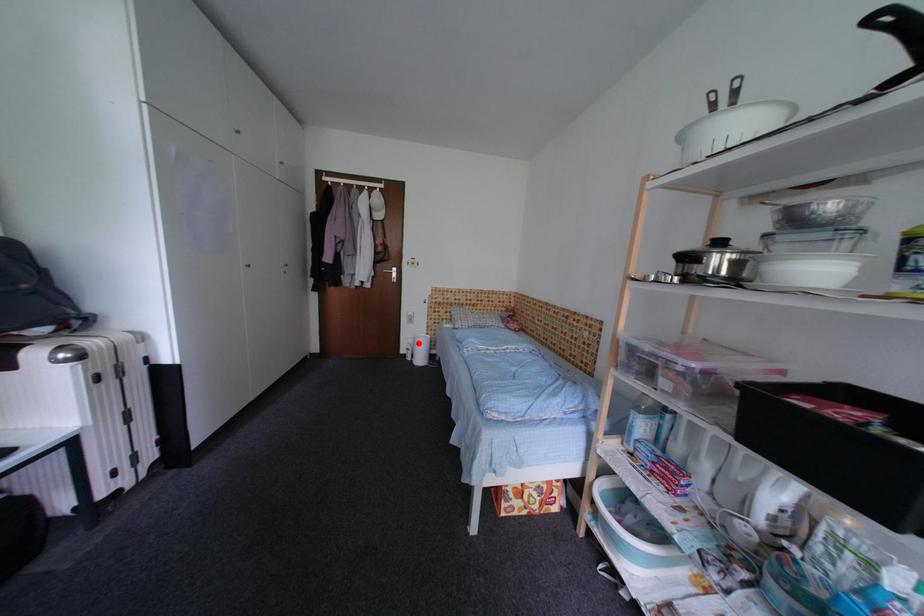
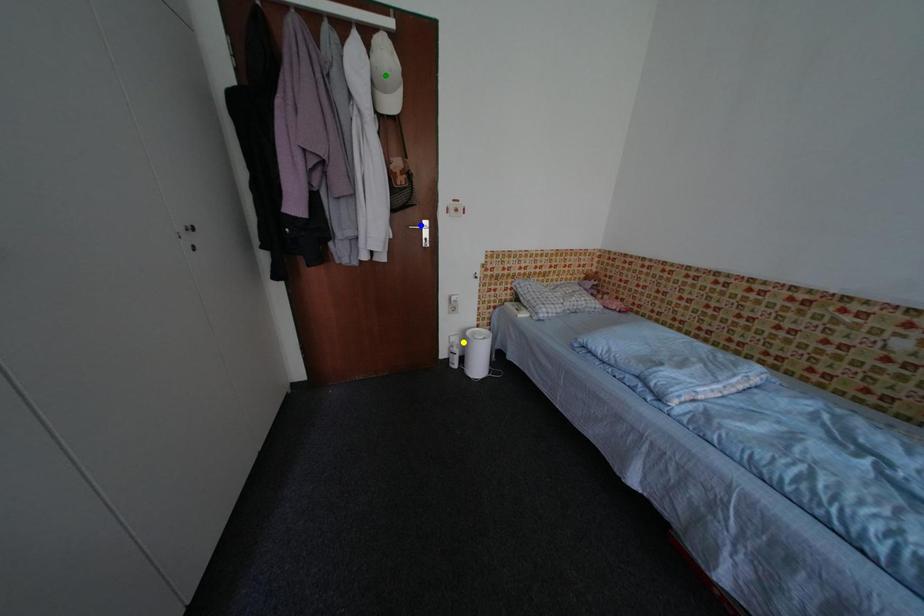
Question: I am providing you with two images of the same scene from different viewpoints. A red point is marked on the first image. You are given multiple points on the second image. Which point in image 2 is actually the same real-world point as the red point in image 1?

Choices:
 (A) green point
 (B) yellow point
 (C) blue point

Answer: (B)